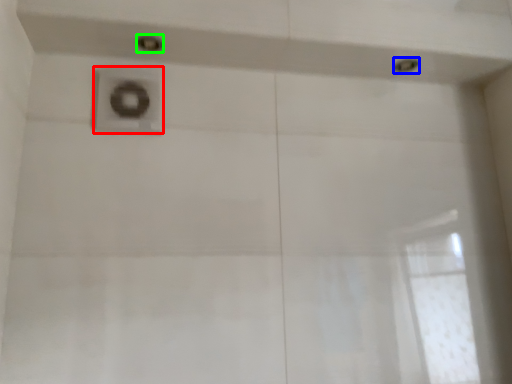
Question: Considering the real-world distances, which object is farthest from plumbing fixture (highlighted by a red box)? shower (highlighted by a blue box) or shower (highlighted by a green box)?

Choices:
 (A) shower
 (B) shower

Answer: (A)